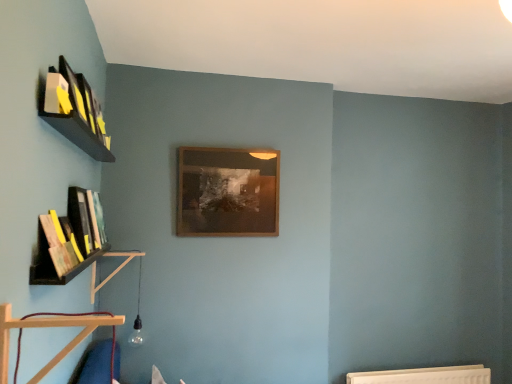
Question: Choose the correct answer: Is matte yellow book at upper left, which is the third book from back to front, inside wooden at lower left, acting as the first shelf starting from the front, or outside it?

Choices:
 (A) outside
 (B) inside

Answer: (A)

Question: From the image's perspective, is matte yellow book at upper left, which is the third book from back to front, located above or below wooden at lower left, which is counted as the 2th shelf, starting from the back?

Choices:
 (A) below
 (B) above

Answer: (B)

Question: Which of these objects is positioned farthest from the wooden at left, the first shelf in the back-to-front sequence?

Choices:
 (A) wooden picture frame at center
 (B) matte yellow book at upper left, which ranks as the first book in right-to-left order
 (C) wooden at lower left, acting as the first shelf starting from the front
 (D) hardcover book at left, the 2th book in the left-to-right sequence
 (E) hardcover book at left, arranged as the third book when viewed from the right

Answer: (C)

Question: Considering the real-world distances, which object is farthest from the wooden at lower left, the 2th shelf positioned from the left?

Choices:
 (A) hardcover book at left, the second book from the top
 (B) matte yellow book at upper left, the third book in the left-to-right sequence
 (C) wooden at left, the first shelf in the back-to-front sequence
 (D) wooden picture frame at center
 (E) hardcover book at left, arranged as the third book when viewed from the right

Answer: (D)